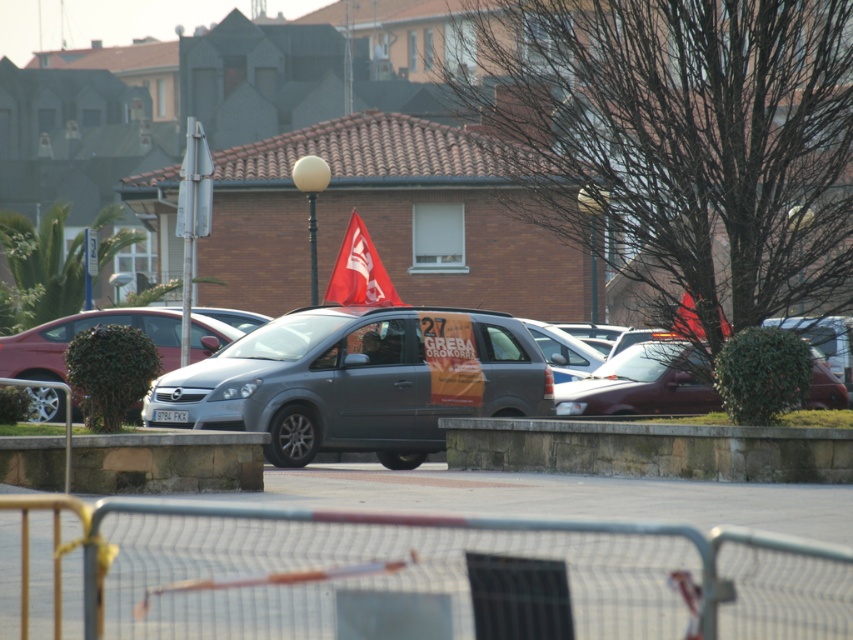
Question: Where is silver metallic van at center located in relation to matte red flag at center in the image?

Choices:
 (A) below
 (B) above

Answer: (A)

Question: Which point is farther from the camera taking this photo?

Choices:
 (A) (345, 257)
 (B) (172, 337)
 (C) (590, 432)
 (D) (270, 342)

Answer: (B)

Question: Is metallic gray van at center to the right of satin silver sedan at center from the viewer's perspective?

Choices:
 (A) no
 (B) yes

Answer: (B)

Question: Which point is farther to the camera?

Choices:
 (A) (395, 445)
 (B) (817, 381)

Answer: (B)

Question: Which point is closer to the camera?

Choices:
 (A) metallic gray van at center
 (B) matte red flag at center
 (C) matte gray van at center

Answer: (A)

Question: Is metallic gray van at center further to the viewer compared to red fabric flag at center?

Choices:
 (A) no
 (B) yes

Answer: (B)